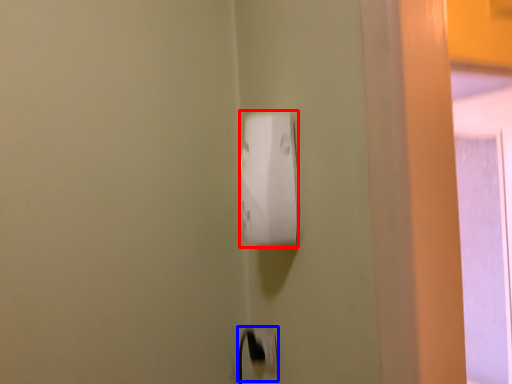
Question: Which object is closer to the camera taking this photo, power plugs and sockets (highlighted by a red box) or electric outlet (highlighted by a blue box)?

Choices:
 (A) power plugs and sockets
 (B) electric outlet

Answer: (A)